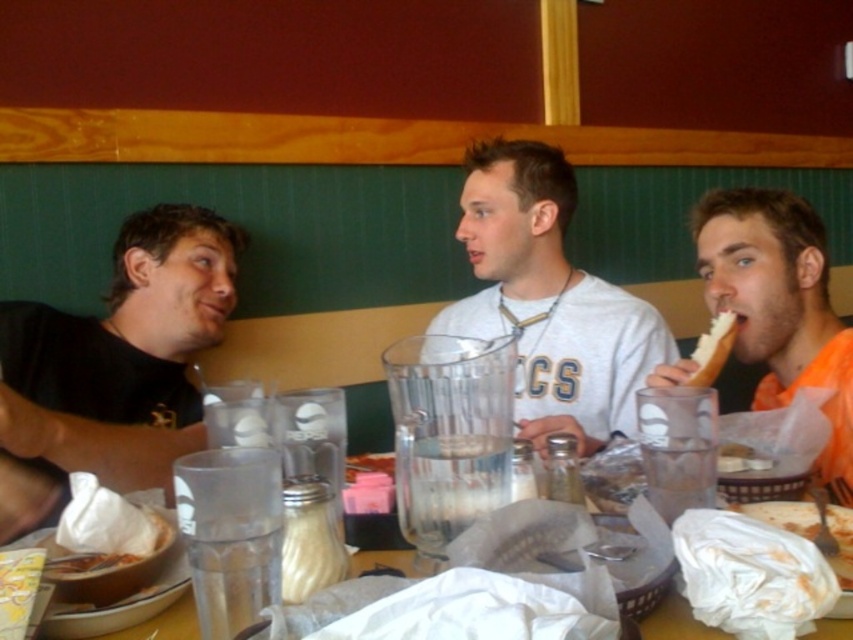
You are a waiter in a restaurant and need to place a new order of white bread at right on the table. Where should you place it so it doesn not get in the way of the clear plastic cups at center?

Since the clear plastic cups at center are larger in size than the white bread at right, you should place the white bread at right in an area that is not directly under or overlapping with the clear plastic cups at center to avoid blocking them.

You are a customer at the restaurant and want to grab a clear plastic cup. The server tells you that the cup you want is located at point (131,611). Can you confirm if this point corresponds to the clear plastic cups at center?

Yes, the clear plastic cups at center is represented by point (131,611).